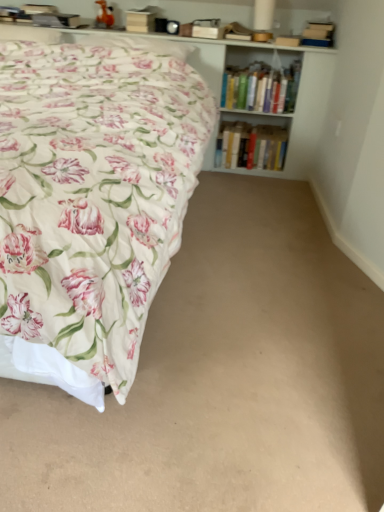
Question: Can you confirm if white wooden bookcase at upper center is wider than hardcover books at upper right, which appears as the 2th book when ordered from the bottom?

Choices:
 (A) no
 (B) yes

Answer: (A)

Question: Can you confirm if white wooden bookcase at upper center is taller than hardcover books at upper right, which appears as the 2th book when ordered from the bottom?

Choices:
 (A) no
 (B) yes

Answer: (B)

Question: Would you consider white wooden bookcase at upper center to be distant from hardcover books at upper right, the 1th book viewed from the top?

Choices:
 (A) yes
 (B) no

Answer: (B)

Question: Is white wooden bookcase at upper center positioned beyond the bounds of hardcover books at upper right, which appears as the 2th book when ordered from the bottom?

Choices:
 (A) yes
 (B) no

Answer: (A)

Question: Is white wooden bookcase at upper center beside hardcover books at upper right, which appears as the 2th book when ordered from the bottom?

Choices:
 (A) no
 (B) yes

Answer: (A)

Question: Could you tell me if white wooden bookcase at upper center is facing hardcover books at upper right, the 1th book viewed from the top?

Choices:
 (A) yes
 (B) no

Answer: (A)

Question: Could you tell me if beige carpet at lower center is turned towards floral cotton bed at left?

Choices:
 (A) yes
 (B) no

Answer: (B)

Question: From a real-world perspective, is beige carpet at lower center below floral cotton bed at left?

Choices:
 (A) yes
 (B) no

Answer: (A)

Question: Considering the relative sizes of beige carpet at lower center and floral cotton bed at left in the image provided, is beige carpet at lower center taller than floral cotton bed at left?

Choices:
 (A) yes
 (B) no

Answer: (B)

Question: Is beige carpet at lower center in contact with floral cotton bed at left?

Choices:
 (A) no
 (B) yes

Answer: (A)

Question: Is beige carpet at lower center positioned behind floral cotton bed at left?

Choices:
 (A) no
 (B) yes

Answer: (B)

Question: Considering the relative sizes of beige carpet at lower center and floral cotton bed at left in the image provided, is beige carpet at lower center smaller than floral cotton bed at left?

Choices:
 (A) yes
 (B) no

Answer: (A)

Question: Is hardcover books at upper right, which appears as the 2th book when ordered from the bottom, wider than white wooden bookcase at upper center?

Choices:
 (A) no
 (B) yes

Answer: (B)